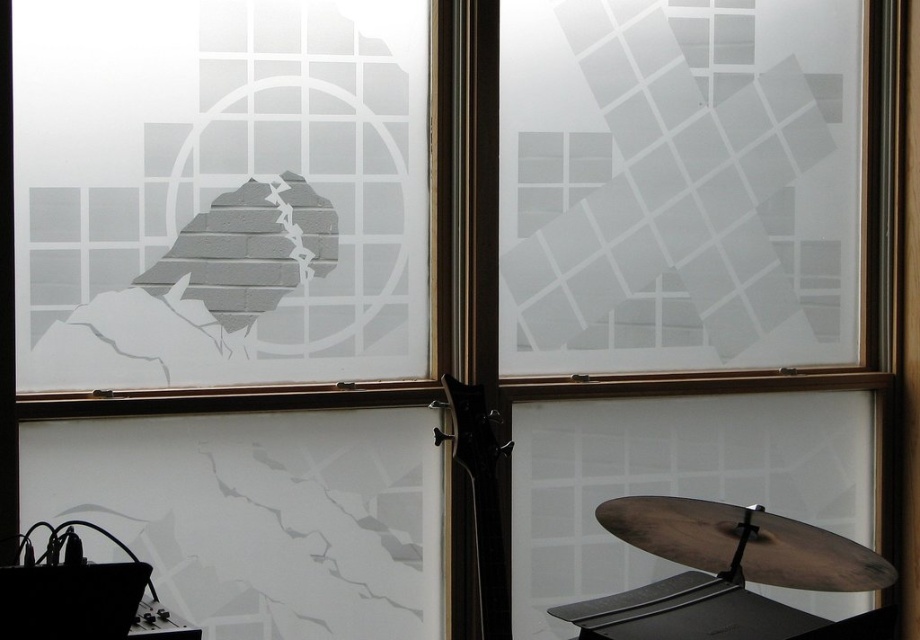
You are a stagehand setting up for a performance. You need to place a glossy black guitar at center so it doesn not block the frosted glass window at upper left. Based on the scene description, will the guitar fit without blocking the window?

The frosted glass window at upper left might be wider than glossy black guitar at center, so there is a possibility that the guitar can be placed without blocking the window if positioned correctly.

Consider the image. You are a musician setting up for a performance. You need to place your glossy black guitar at center on a stand. However, there is a frosted glass window at upper left in the way. Can you move the guitar to the stand without moving the window?

The frosted glass window at upper left is positioned over the glossy black guitar at center, meaning the guitar is already under the window. Since the window is part of the room structure, you cannot move it, so you would need to adjust the guitar stand placement to avoid obstruction.

You are a musician preparing to set up your equipment in the room. You have a glossy black guitar at center and a frosted glass window at upper left. Which object is taller?

The frosted glass window at upper left is taller than the glossy black guitar at center.